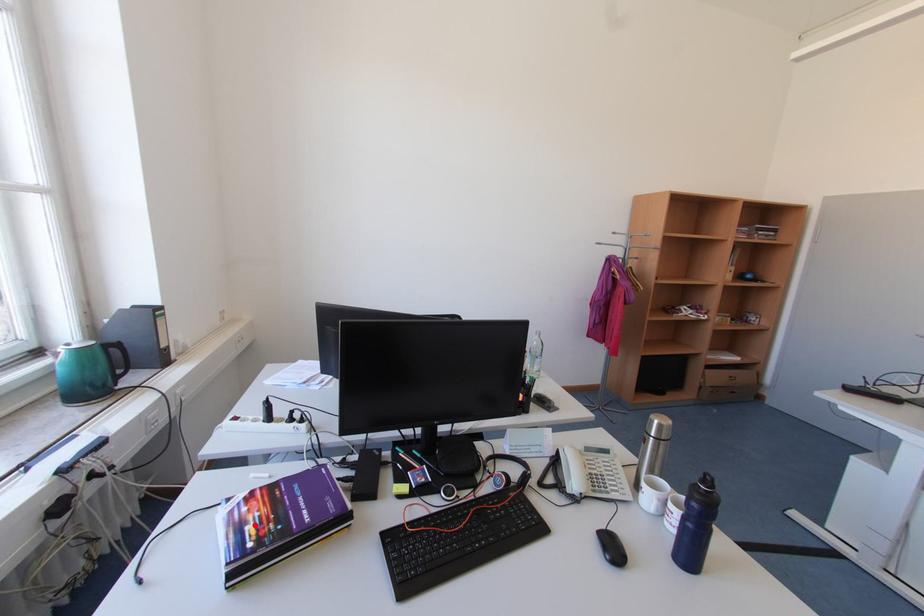
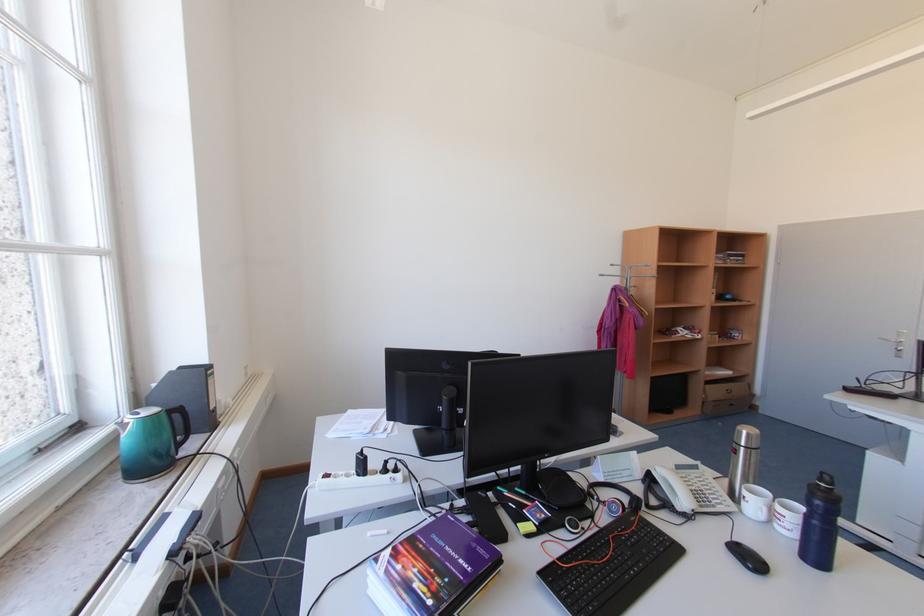
Locate, in the second image, the point that corresponds to the highlighted location in the first image.

(419, 583)